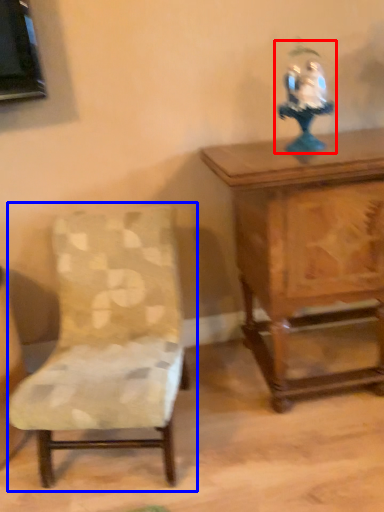
Question: Which object appears closest to the camera in this image, toy (highlighted by a red box) or chair (highlighted by a blue box)?

Choices:
 (A) toy
 (B) chair

Answer: (B)